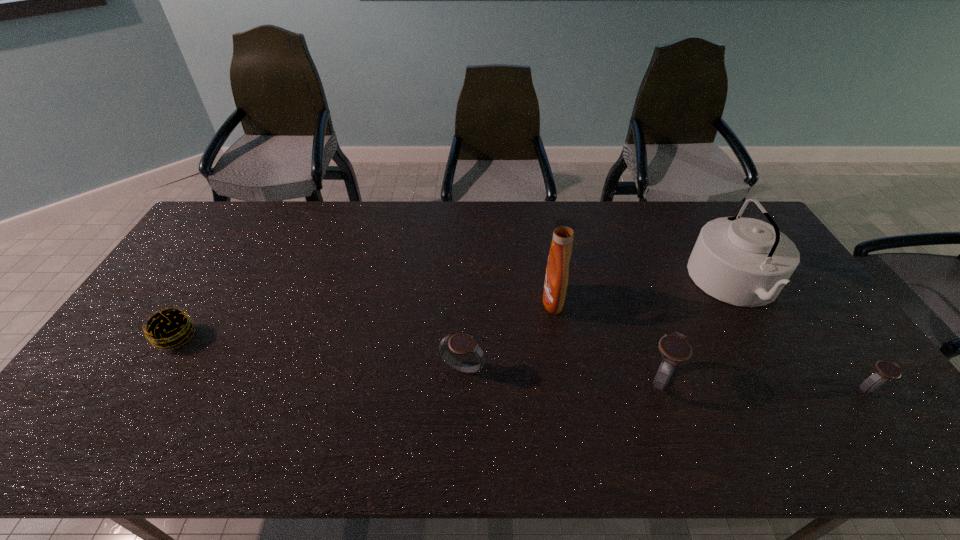
Point out which watch is positioned as the second nearest to the second watch from left to right. Please provide its 2D coordinates. Your answer should be formatted as a tuple, i.e. [(x, y)], where the tuple contains the x and y coordinates of a point satisfying the conditions above.

[(884, 370)]

Where is `watch that stands as the second closest to the second watch from right to left`? The height and width of the screenshot is (540, 960). watch that stands as the second closest to the second watch from right to left is located at coordinates (884, 370).

Image resolution: width=960 pixels, height=540 pixels. In order to click on free region that satisfies the following two spatial constraints: 1. on the front-facing side of the fourth object from right to left; 2. on the back side of the second watch from left to right in this screenshot , I will do `click(565, 379)`.

At what (x,y) coordinates should I click in order to perform the action: click on free spot that satisfies the following two spatial constraints: 1. on the spout of the second tallest object; 2. on the left side of the shortest watch. Please return your answer as a coordinate pair (x, y). This screenshot has width=960, height=540. Looking at the image, I should click on (799, 389).

This screenshot has height=540, width=960. I want to click on free location that satisfies the following two spatial constraints: 1. on the back side of the shortest watch; 2. on the front-facing side of the detergent, so click(804, 301).

Image resolution: width=960 pixels, height=540 pixels. I want to click on free location that satisfies the following two spatial constraints: 1. on the spout of the second tallest object; 2. on the front side of the fourth object from left to right, so pyautogui.click(x=792, y=379).

You are a GUI agent. You are given a task and a screenshot of the screen. Output one action in this format:
    pyautogui.click(x=<x>, y=<y>)
    Task: Click on the vacant area that satisfies the following two spatial constraints: 1. on the front-facing side of the detergent; 2. on the front side of the patty
    
    Given the screenshot: What is the action you would take?
    pyautogui.click(x=559, y=337)